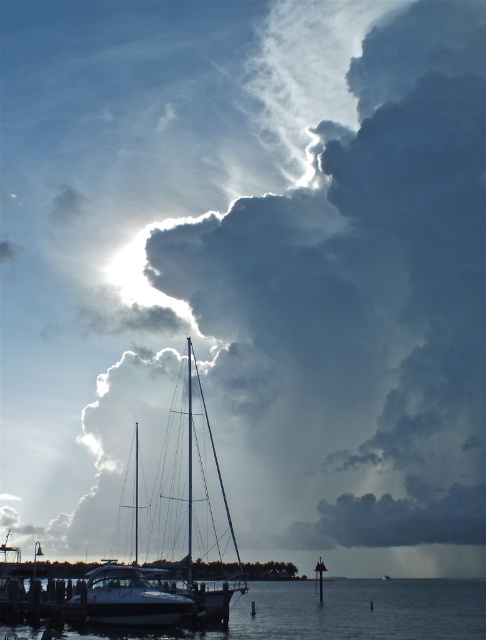
Describe the element at coordinates (341, 612) in the screenshot. This screenshot has width=486, height=640. I see `transparent water at lower center` at that location.

Can you confirm if transparent water at lower center is smaller than white glossy boat at lower center?

Incorrect, transparent water at lower center is not smaller in size than white glossy boat at lower center.

Image resolution: width=486 pixels, height=640 pixels. Find the location of `transparent water at lower center`. transparent water at lower center is located at coordinates (341, 612).